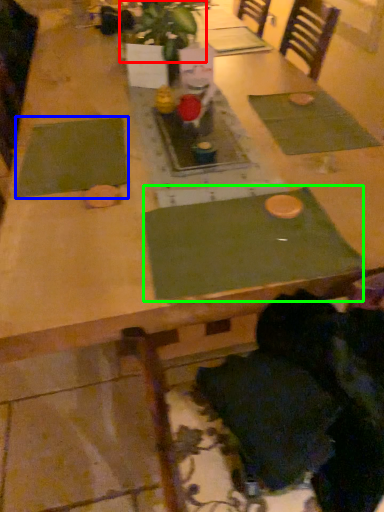
Question: Which object is positioned farthest from plant (highlighted by a red box)? Select from place mat (highlighted by a blue box) and place mat (highlighted by a green box).

Choices:
 (A) place mat
 (B) place mat

Answer: (B)